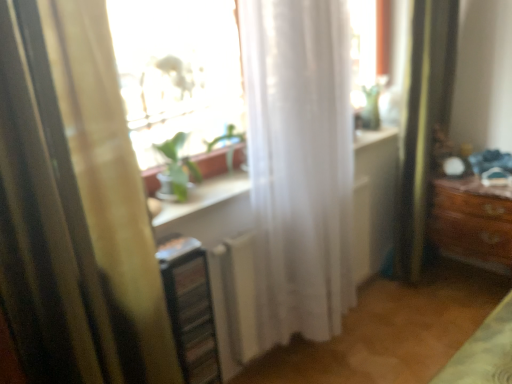
Locate an element on the screen. This screenshot has width=512, height=384. free area below transparent glass window at center (from a real-world perspective) is located at coordinates (182, 203).